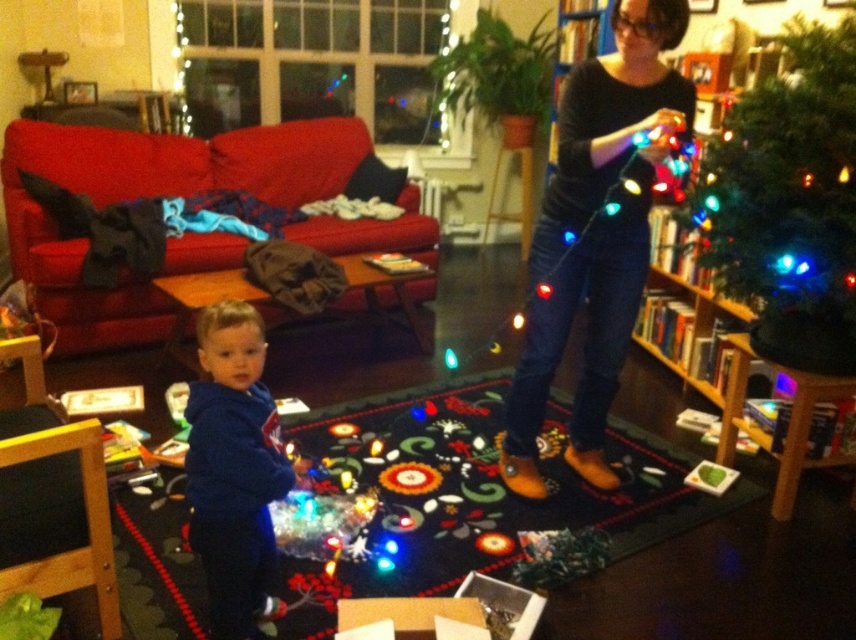
Question: Estimate the real-world distances between objects in this image. Which object is closer to the green matte christmas tree at upper right?

Choices:
 (A) blue fleece hoodie at lower left
 (B) black leather boots at center

Answer: (B)

Question: Is the position of black leather boots at center less distant than that of blue fleece hoodie at lower left?

Choices:
 (A) yes
 (B) no

Answer: (B)

Question: Can you confirm if green matte christmas tree at upper right is positioned to the left of blue fleece hoodie at lower left?

Choices:
 (A) no
 (B) yes

Answer: (A)

Question: Which point is closer to the camera?

Choices:
 (A) black leather boots at center
 (B) green matte christmas tree at upper right
 (C) blue fleece hoodie at lower left

Answer: (C)

Question: Which object is positioned farthest from the green matte christmas tree at upper right?

Choices:
 (A) black leather boots at center
 (B) blue fleece hoodie at lower left

Answer: (B)

Question: Is green matte christmas tree at upper right smaller than blue fleece hoodie at lower left?

Choices:
 (A) yes
 (B) no

Answer: (B)